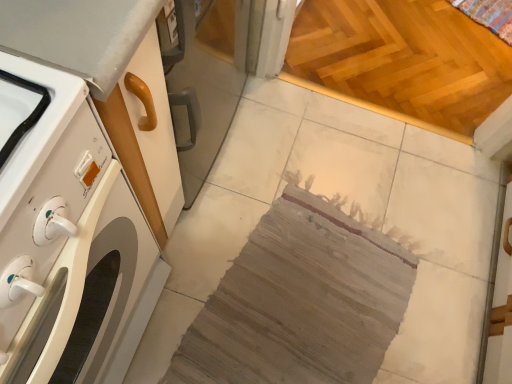
Question: Choose the correct answer: Is woven fabric rug at center inside light brown wooden floor at upper right or outside it?

Choices:
 (A) inside
 (B) outside

Answer: (B)

Question: Is point (325, 314) closer or farther from the camera than point (419, 97)?

Choices:
 (A) farther
 (B) closer

Answer: (B)

Question: Based on their relative distances, which object is nearer to the woven fabric rug at center?

Choices:
 (A) light brown wooden floor at upper right
 (B) white glossy washing machine at left

Answer: (B)

Question: Based on their relative distances, which object is farther from the light brown wooden floor at upper right?

Choices:
 (A) woven fabric rug at center
 (B) white glossy washing machine at left

Answer: (B)